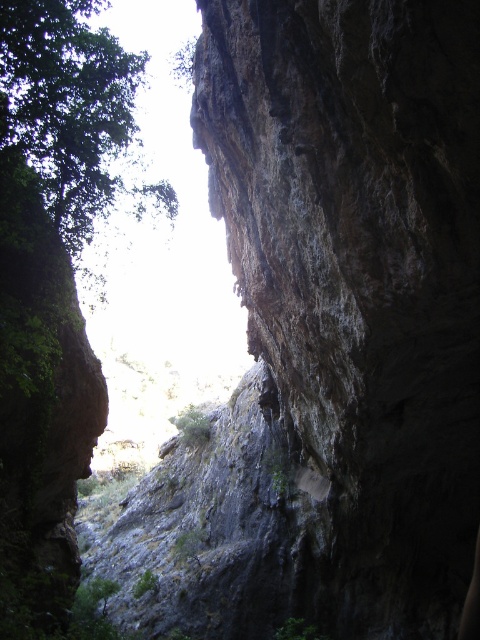
Question: Which point appears farthest from the camera in this image?

Choices:
 (A) (450, 564)
 (B) (25, 36)

Answer: (B)

Question: Among these objects, which one is nearest to the camera?

Choices:
 (A) dark brown rocky cliff at upper right
 (B) green leafy tree at upper left

Answer: (A)

Question: Is dark brown rocky cliff at upper right bigger than green leafy tree at upper left?

Choices:
 (A) yes
 (B) no

Answer: (A)

Question: Is dark brown rocky cliff at upper right bigger than green leafy tree at upper left?

Choices:
 (A) yes
 (B) no

Answer: (A)

Question: Which object appears farthest from the camera in this image?

Choices:
 (A) green leafy tree at upper left
 (B) dark brown rocky cliff at upper right

Answer: (A)

Question: Is dark brown rocky cliff at upper right thinner than green leafy tree at upper left?

Choices:
 (A) no
 (B) yes

Answer: (A)